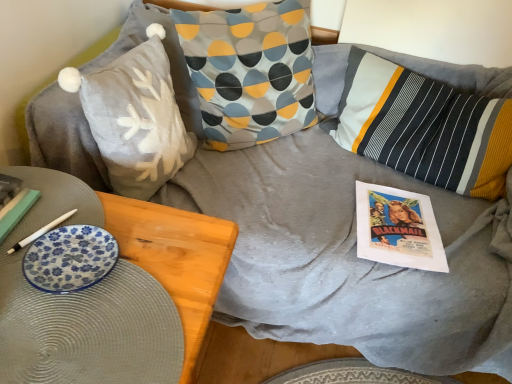
The height and width of the screenshot is (384, 512). What are the coordinates of `free location to the right of blue floral plate at lower left` in the screenshot? It's located at (166, 276).